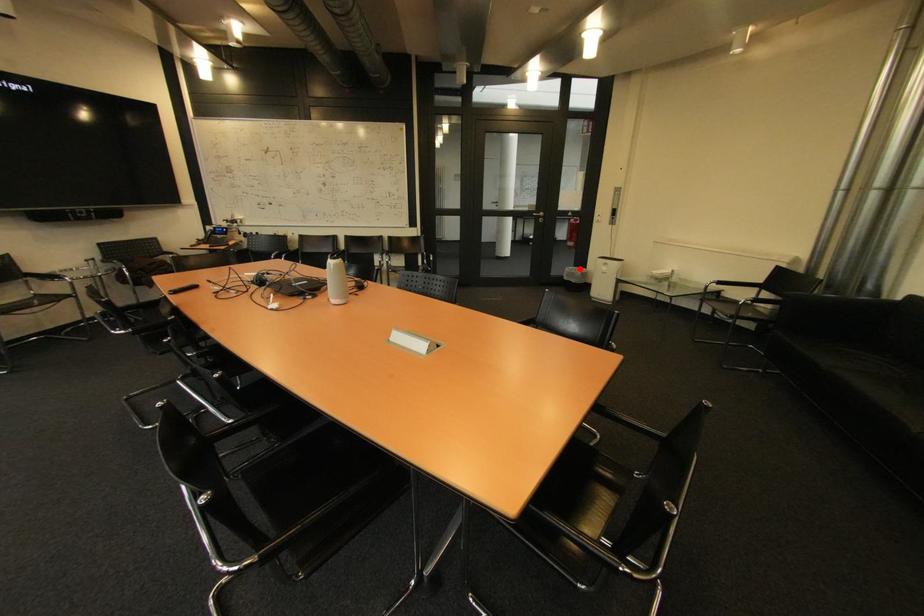
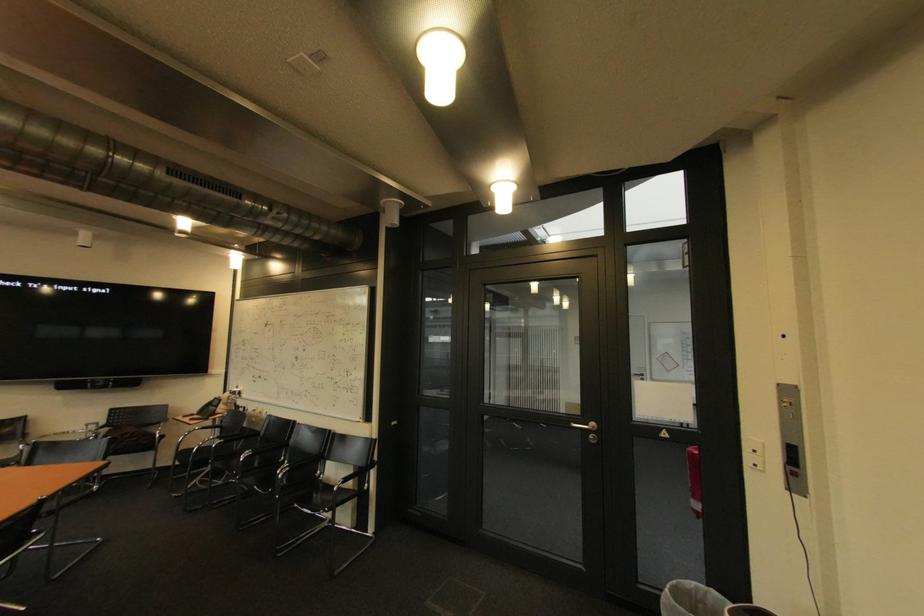
Question: I am providing you with two images of the same scene from different viewpoints. In image1, a red point is highlighted. Considering the same 3D point in image2, which of the following is correct?

Choices:
 (A) It is closer
 (B) It is farther

Answer: (B)